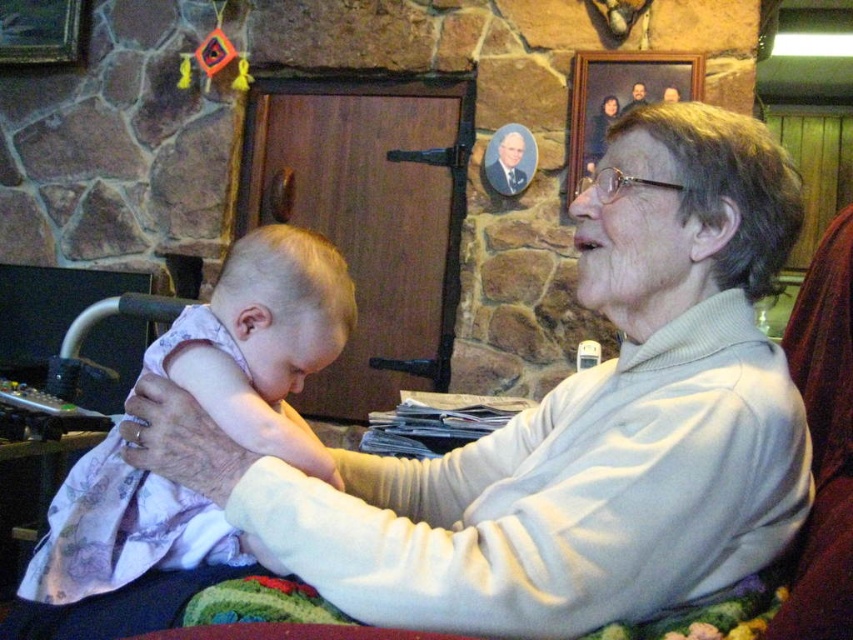
Between white sweater at center and light pink fabric at center, which one has less height?

light pink fabric at center

Is white sweater at center bigger than light pink fabric at center?

Correct, white sweater at center is larger in size than light pink fabric at center.

Between point (265, 493) and point (318, 289), which one is positioned in front?

Point (265, 493)

At what (x,y) coordinates should I click in order to perform the action: click on white sweater at center. Please return your answer as a coordinate pair (x, y). Looking at the image, I should click on (572, 424).